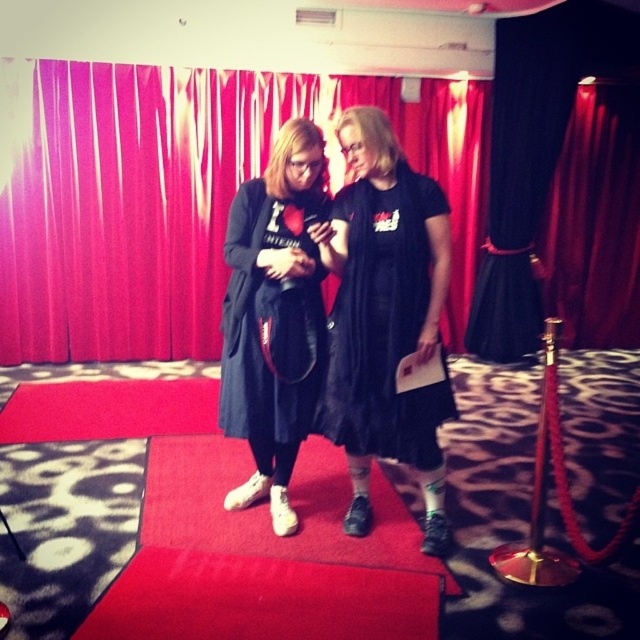
Question: Can you confirm if matte black dress at center is smaller than black matte dress at center?

Choices:
 (A) yes
 (B) no

Answer: (B)

Question: Estimate the real-world distances between objects in this image. Which object is closer to the black matte dress at center?

Choices:
 (A) red velvet curtain at center
 (B) matte black dress at center

Answer: (B)

Question: Which of these objects is positioned farthest from the black matte dress at center?

Choices:
 (A) red velvet curtain at center
 (B) matte black dress at center

Answer: (A)

Question: Is red velvet curtain at center to the right of matte black dress at center from the viewer's perspective?

Choices:
 (A) no
 (B) yes

Answer: (A)

Question: Is red velvet curtain at center smaller than matte black dress at center?

Choices:
 (A) no
 (B) yes

Answer: (B)

Question: Considering the real-world distances, which object is closest to the matte black dress at center?

Choices:
 (A) black matte dress at center
 (B) red velvet curtain at center

Answer: (A)